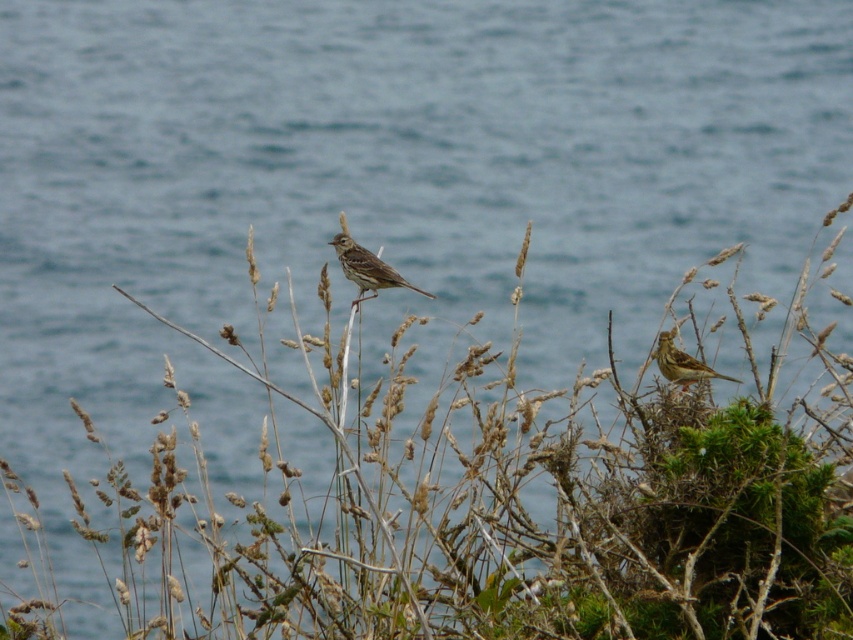
You are a birdwatcher observing the scene. You notice a point marked at coordinates (367,268) in the image. Which bird is this point located on?

The point at coordinates (367,268) is located on the brown speckled sparrow at center.

You are a birdwatcher trying to locate two points of interest in the scene. The first point is at coordinates point [373,257] and the second is at point [662,340]. Which point is closer to you, the observer?

Point [373,257] is closer to you than point [662,340] because it is further to the viewer than the other point.